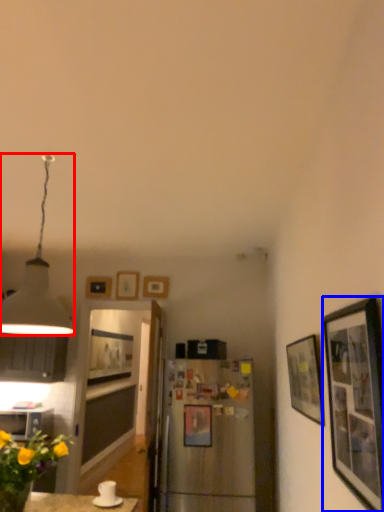
Question: Which of the following is the closest to the observer, lamp (highlighted by a red box) or picture frame (highlighted by a blue box)?

Choices:
 (A) lamp
 (B) picture frame

Answer: (B)